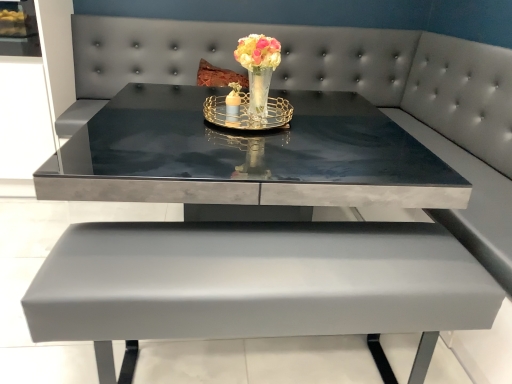
Image resolution: width=512 pixels, height=384 pixels. In order to click on free space in front of gold metallic tray at center in this screenshot , I will do `click(287, 152)`.